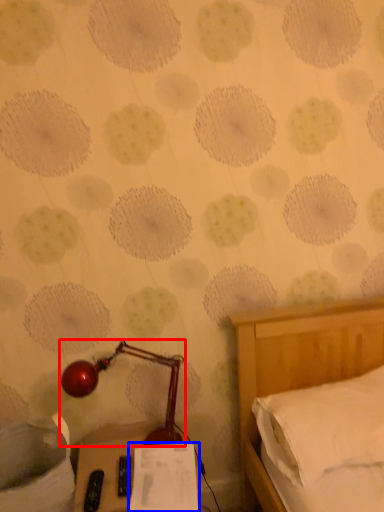
Question: Which object appears farthest to the camera in this image, lamp (highlighted by a red box) or paper (highlighted by a blue box)?

Choices:
 (A) lamp
 (B) paper

Answer: (A)